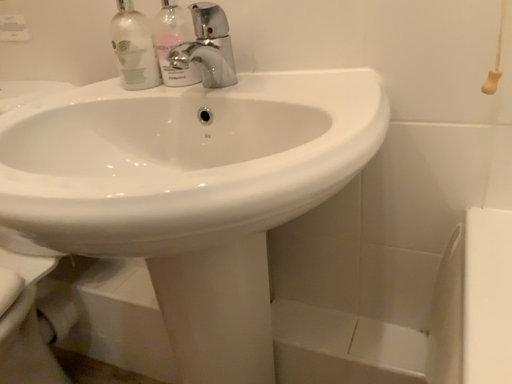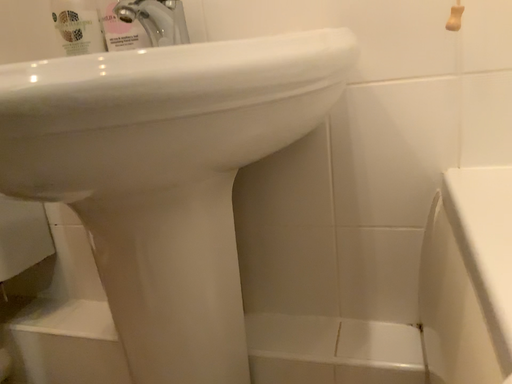
Question: How did the camera likely rotate when shooting the video?

Choices:
 (A) rotated left
 (B) rotated right

Answer: (B)